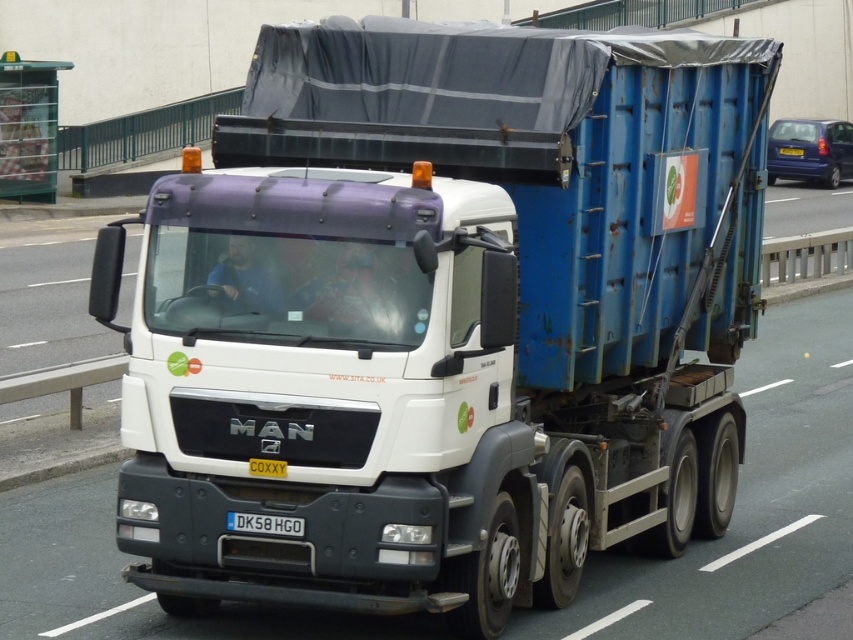
Question: Which of the following is the farthest from the observer?

Choices:
 (A) black plastic license plate at bottom
 (B) yellow metallic license plate at center
 (C) white plastic license plate at center

Answer: (B)

Question: Does black plastic license plate at bottom appear under white plastic license plate at center?

Choices:
 (A) yes
 (B) no

Answer: (A)

Question: Which object is farther from the camera taking this photo?

Choices:
 (A) white plastic license plate at center
 (B) black plastic license plate at bottom
 (C) yellow metallic license plate at center

Answer: (C)

Question: Does white plastic license plate at center appear on the right side of yellow metallic license plate at center?

Choices:
 (A) no
 (B) yes

Answer: (A)

Question: Among these points, which one is nearest to the camera?

Choices:
 (A) (265, 515)
 (B) (260, 467)

Answer: (B)

Question: Where is white plastic license plate at center located in relation to yellow metallic license plate at center in the image?

Choices:
 (A) below
 (B) above

Answer: (A)